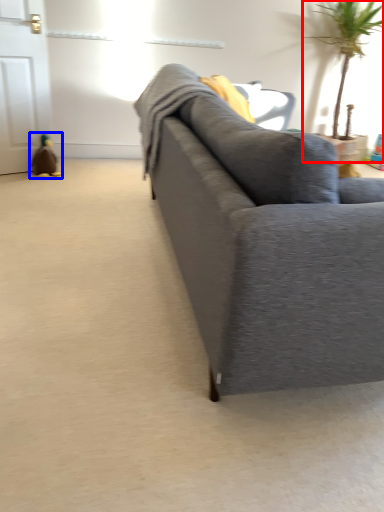
Question: Among these objects, which one is farthest to the camera, houseplant (highlighted by a red box) or toy (highlighted by a blue box)?

Choices:
 (A) houseplant
 (B) toy

Answer: (B)